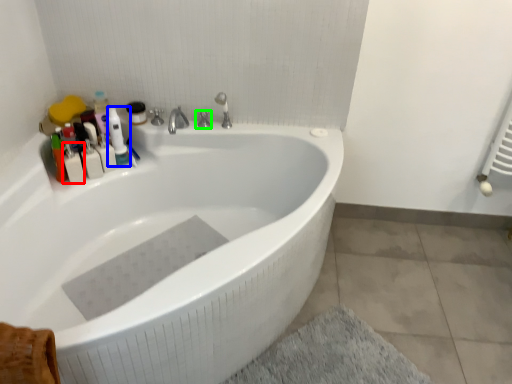
Question: Which object is the farthest from toiletry (highlighted by a red box)? Choose among these: cleaning product (highlighted by a blue box) or tap (highlighted by a green box).

Choices:
 (A) cleaning product
 (B) tap

Answer: (B)